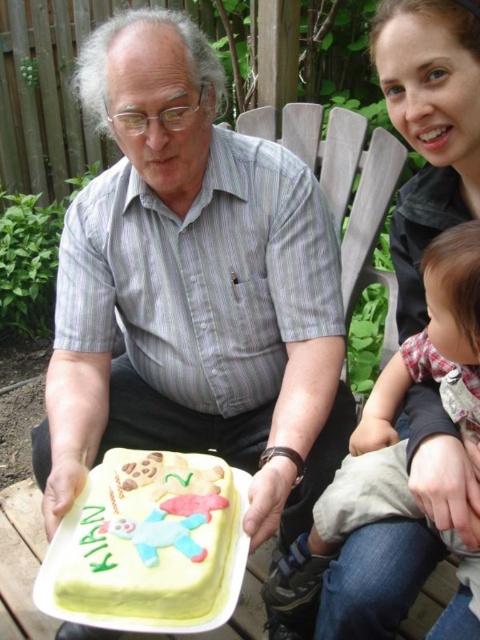
You are planning to place the yellow fondant cake at center and the fluffy pink fabric at lower right on a table. If the table can only accommodate items with a width of 50 cm or less, which item might not fit based on their sizes?

The fluffy pink fabric at lower right might not fit because its width is greater than the yellow fondant cake at center, which may exceed the table limit of 50 cm.

You are a photographer setting up for a birthday photo. You need to ensure the yellow fondant cake at center is visible in the shot. The fluffy pink fabric at lower right is part of the backdrop. Is the cake placed in a position where it won

The yellow fondant cake at center is positioned over the fluffy pink fabric at lower right, so the cake is placed directly on top of the fabric. This means the cake will be clearly visible against the fabric backdrop without any obstruction.